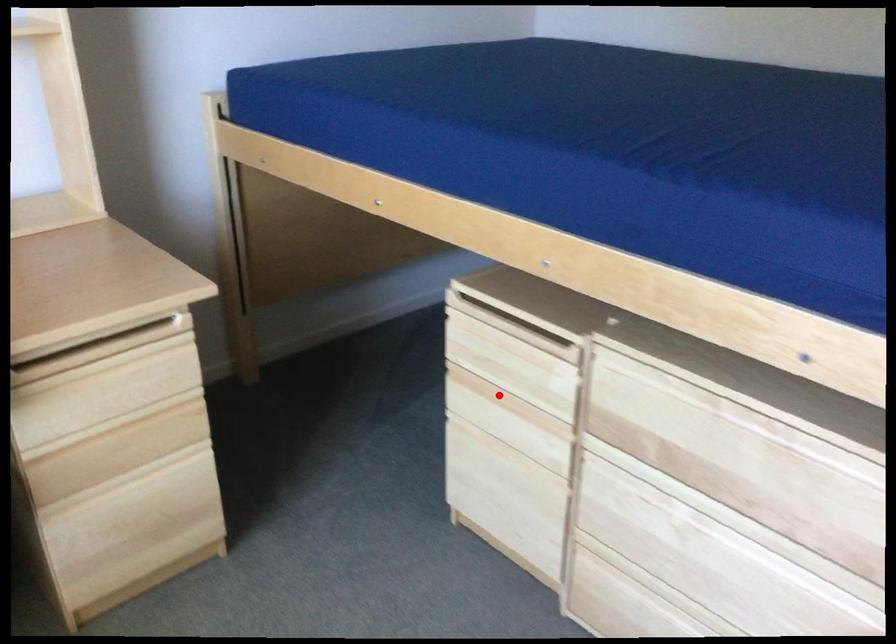
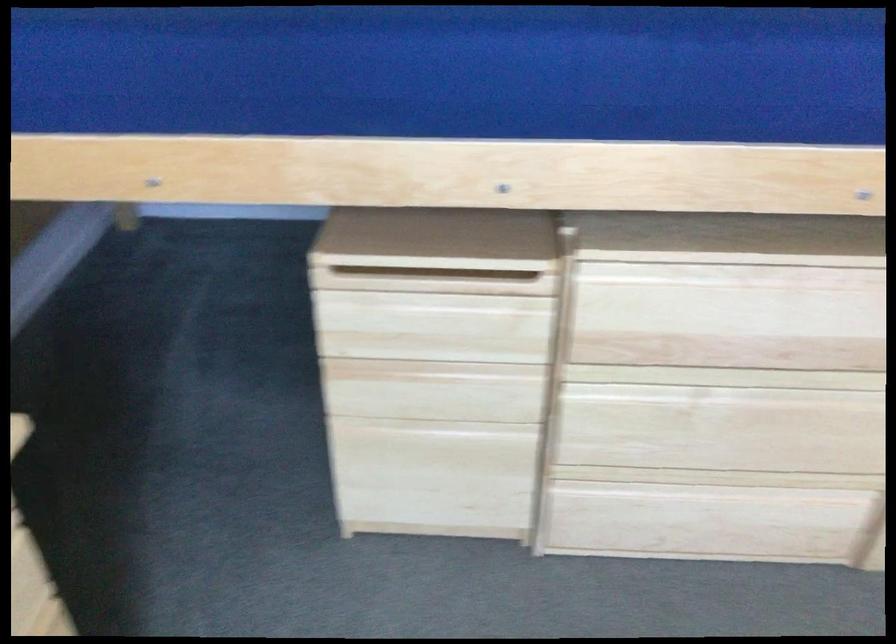
Where in the second image is the point corresponding to the highlighted location from the first image?

(426, 371)